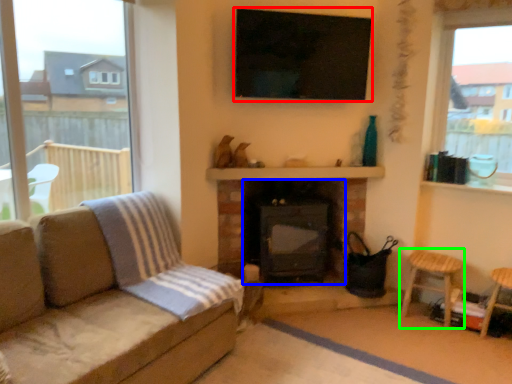
Question: Which object is positioned closest to window screen (highlighted by a red box)? Select from fireplace (highlighted by a blue box) and bar stool (highlighted by a green box).

Choices:
 (A) fireplace
 (B) bar stool

Answer: (A)